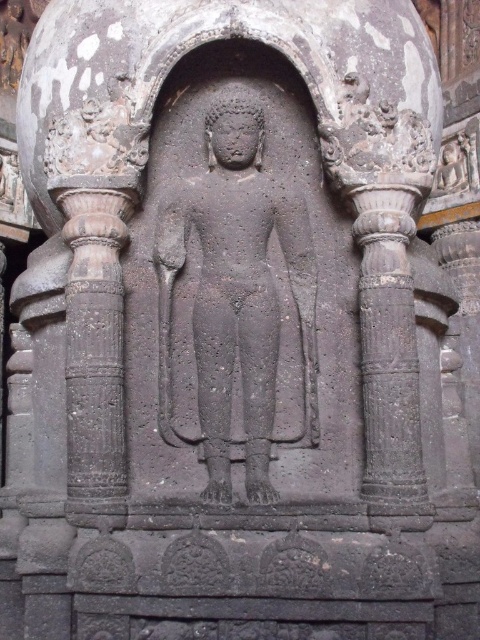
Question: Is black stone statue at center closer to camera compared to dark gray stone column at left?

Choices:
 (A) yes
 (B) no

Answer: (B)

Question: Considering the real-world distances, which object is closest to the dark gray stone column at left?

Choices:
 (A) black stone statue at center
 (B) dark gray stone column at right

Answer: (A)

Question: Which object is positioned closest to the dark gray stone column at right?

Choices:
 (A) dark gray stone column at left
 (B) black stone statue at center

Answer: (B)

Question: Can you confirm if black stone statue at center is positioned below dark gray stone column at right?

Choices:
 (A) yes
 (B) no

Answer: (B)

Question: Can you confirm if dark gray stone column at left is positioned above dark gray stone column at right?

Choices:
 (A) yes
 (B) no

Answer: (B)

Question: Estimate the real-world distances between objects in this image. Which object is farther from the dark gray stone column at left?

Choices:
 (A) black stone statue at center
 (B) dark gray stone column at right

Answer: (B)